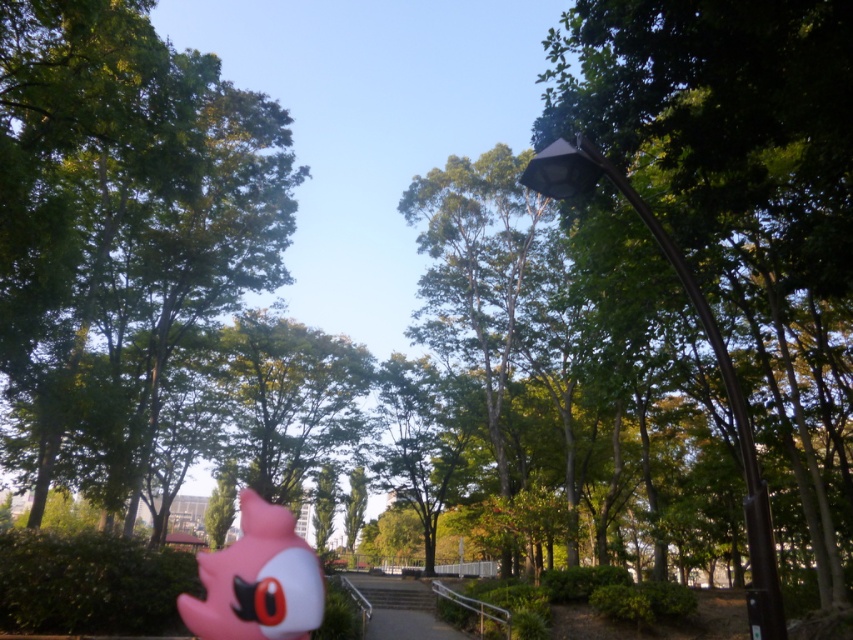
You are standing in the park and want to take a photo of the green leafy tree at center. If you move 0.2 units to the right along the x and y axes, will you still be able to see the tree in your view?

The green leafy tree at center is located at point [120,221]. Moving 0.2 units to the right along both axes would place you at approximately [292,349]. Since the tree is at [120,221], it would still be visible in your view as the distance moved is relatively small and within the park area described.

You are planning to place a 35 feet long bench in the park scene shown. The bench must be placed between the green leafy tree at center and the pink matte plush toy at lower left. Is there enough space to fit the bench between them?

The distance between the green leafy tree at center and the pink matte plush toy at lower left is 34.99 feet. Since the bench is 35 feet long, it is slightly too long to fit between them as there is only 34.99 feet of space available.